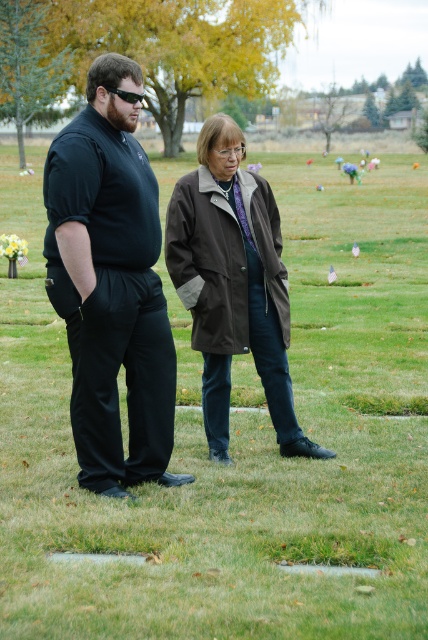
Question: Does matte black pants at center appear over brown canvas coat at center?

Choices:
 (A) no
 (B) yes

Answer: (B)

Question: In this image, where is matte black pants at center located relative to brown canvas coat at center?

Choices:
 (A) above
 (B) below

Answer: (A)

Question: Among these objects, which one is nearest to the camera?

Choices:
 (A) matte black pants at center
 (B) brown canvas coat at center

Answer: (A)

Question: Can you confirm if matte black pants at center is positioned to the left of brown canvas coat at center?

Choices:
 (A) yes
 (B) no

Answer: (A)

Question: Which of the following is the closest to the observer?

Choices:
 (A) (107, 342)
 (B) (196, 323)

Answer: (A)